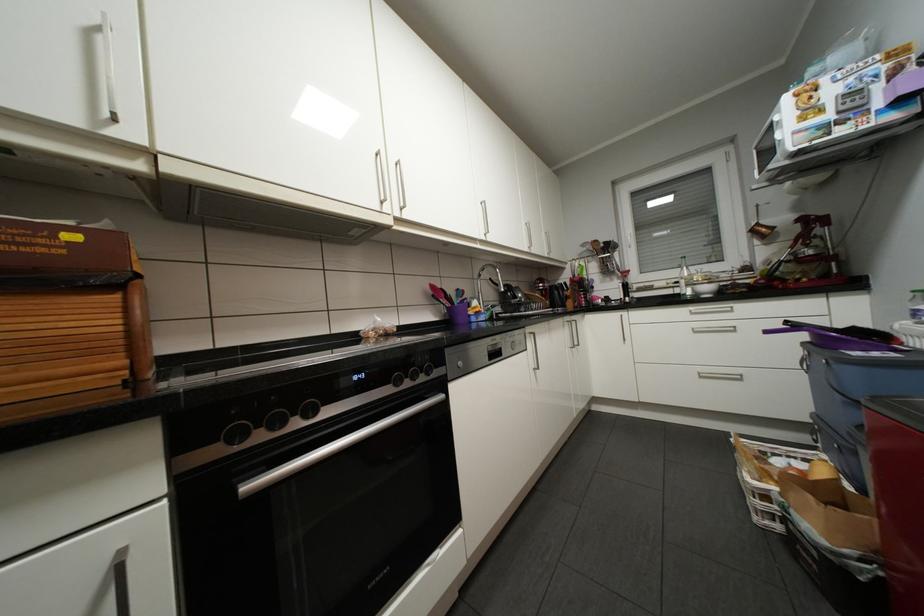
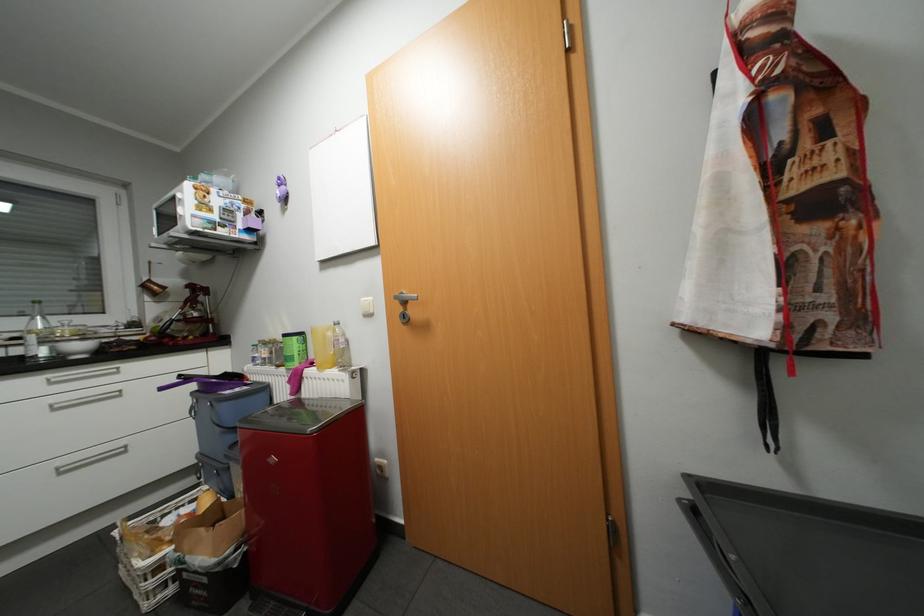
Locate, in the second image, the point that corresponds to pixel 703 331 in the first image.

(64, 408)